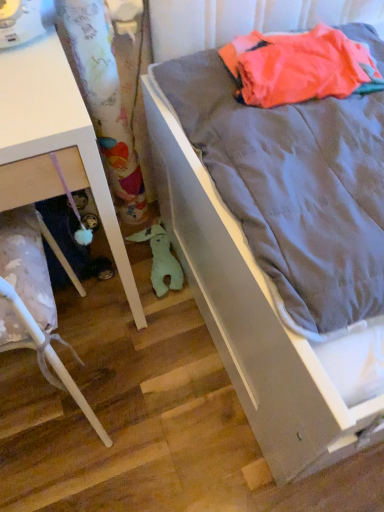
Question: From a real-world perspective, does white glossy drawer at lower left, which is counted as the first furniture, starting from the bottom, sit lower than green plush toy at lower center?

Choices:
 (A) yes
 (B) no

Answer: (B)

Question: Can you confirm if white glossy drawer at lower left, which is counted as the first furniture, starting from the bottom, is bigger than green plush toy at lower center?

Choices:
 (A) yes
 (B) no

Answer: (A)

Question: Could green plush toy at lower center be considered to be inside white glossy drawer at lower left, which is counted as the first furniture, starting from the bottom?

Choices:
 (A) yes
 (B) no

Answer: (B)

Question: Is white glossy drawer at lower left, which appears as the 2th furniture when viewed from the top, wider than green plush toy at lower center?

Choices:
 (A) no
 (B) yes

Answer: (B)

Question: Is white glossy drawer at lower left, which appears as the 2th furniture when viewed from the top, wider or thinner than gray fabric bed at right?

Choices:
 (A) wide
 (B) thin

Answer: (B)

Question: From the image's perspective, is white glossy drawer at lower left, which is counted as the first furniture, starting from the bottom, located above or below gray fabric bed at right?

Choices:
 (A) below
 (B) above

Answer: (A)

Question: From a real-world perspective, relative to gray fabric bed at right, is white glossy drawer at lower left, which is counted as the first furniture, starting from the bottom, vertically above or below?

Choices:
 (A) below
 (B) above

Answer: (A)

Question: Is white glossy drawer at lower left, which appears as the 2th furniture when viewed from the top, bigger or smaller than gray fabric bed at right?

Choices:
 (A) small
 (B) big

Answer: (A)

Question: Considering the positions of point (29, 298) and point (165, 382), is point (29, 298) closer or farther from the camera than point (165, 382)?

Choices:
 (A) closer
 (B) farther

Answer: (A)

Question: Is white glossy drawer at lower left, which is counted as the first furniture, starting from the bottom, bigger or smaller than wooden floor at lower left?

Choices:
 (A) small
 (B) big

Answer: (B)

Question: Considering the relative positions of white glossy drawer at lower left, which is counted as the first furniture, starting from the bottom, and wooden floor at lower left in the image provided, is white glossy drawer at lower left, which is counted as the first furniture, starting from the bottom, to the left or to the right of wooden floor at lower left?

Choices:
 (A) left
 (B) right

Answer: (A)

Question: Is white glossy drawer at lower left, which appears as the 2th furniture when viewed from the top, taller or shorter than wooden floor at lower left?

Choices:
 (A) short
 (B) tall

Answer: (B)

Question: From their relative heights in the image, would you say wooden floor at lower left is taller or shorter than gray fabric bed at right?

Choices:
 (A) short
 (B) tall

Answer: (A)

Question: From the image's perspective, is wooden floor at lower left above or below gray fabric bed at right?

Choices:
 (A) above
 (B) below

Answer: (B)